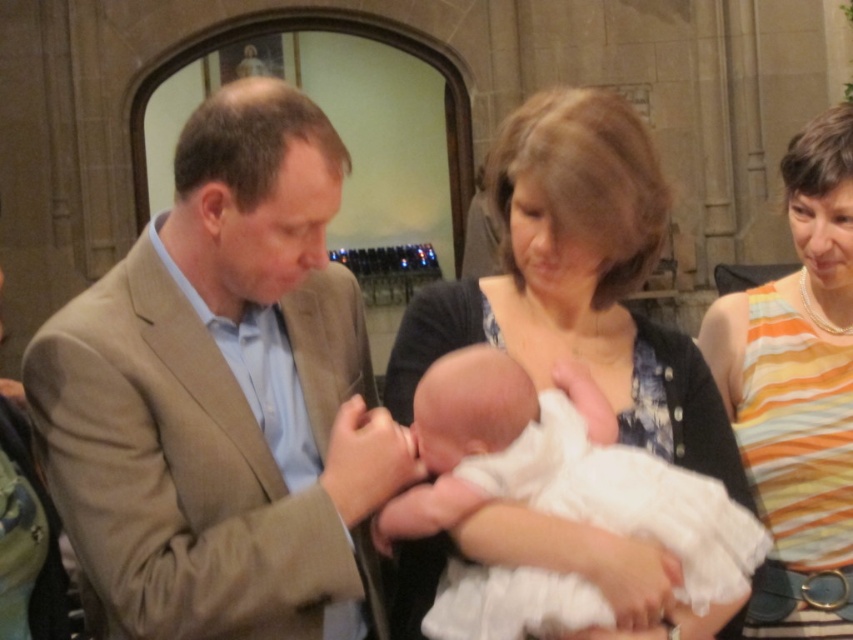
Question: Is orange striped tank top at right closer to camera compared to white clothed newborn at center?

Choices:
 (A) no
 (B) yes

Answer: (A)

Question: Does light brown suit at center lie behind white clothed newborn at center?

Choices:
 (A) no
 (B) yes

Answer: (B)

Question: Can you confirm if light brown suit at center is positioned above orange striped tank top at right?

Choices:
 (A) no
 (B) yes

Answer: (A)

Question: Which object appears closest to the camera in this image?

Choices:
 (A) orange striped tank top at right
 (B) white clothed newborn at center
 (C) light brown suit at center

Answer: (B)

Question: Among these points, which one is farthest from the camera?

Choices:
 (A) (804, 244)
 (B) (215, 173)
 (C) (479, 628)

Answer: (A)

Question: Which object appears farthest from the camera in this image?

Choices:
 (A) light brown suit at center
 (B) orange striped tank top at right

Answer: (B)